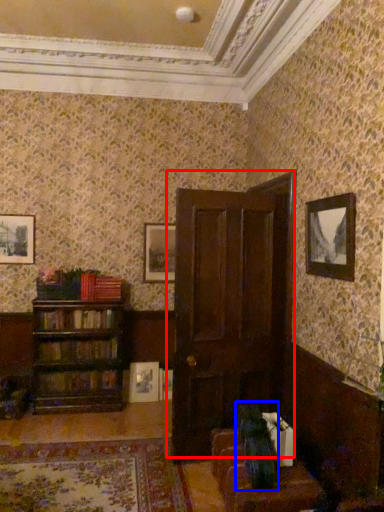
Question: Which of the following is the closest to the observer, door (highlighted by a red box) or swivel chair (highlighted by a blue box)?

Choices:
 (A) door
 (B) swivel chair

Answer: (B)